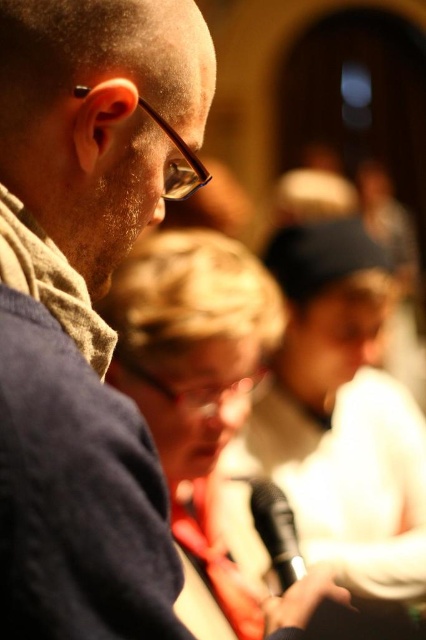
You are a photographer adjusting your camera settings to focus on the matte black glasses at upper left and the black matte microphone at lower center. Since the background is blurred, which object should you prioritize focusing on to ensure both are sharp?

The matte black glasses at upper left is closer to the viewer than the black matte microphone at lower center. To ensure both are sharp, prioritize focusing on the matte black glasses at upper left because it is closer, and the microphone will be within the depth of field if focused properly.

You are a photographer adjusting the camera focus. You need to ensure that both the matte black glasses at upper left and the black matte microphone at lower center are in focus. Given their heights, which object should you prioritize focusing on first to ensure proper depth of field?

The matte black glasses at upper left has a greater height compared to the black matte microphone at lower center. Since it is taller, you should prioritize focusing on the matte black glasses at upper left first to ensure proper depth of field.

You are a photographer who needs to adjust the lighting to ensure the matte black glasses at upper left are properly lit. Given their position at point 0.480, 0.200, where would you place the light source relative to the glasses?

The matte black glasses at upper left are positioned at coordinates 0.480 on the x and 0.200 on the y. To properly light them, the photographer should place the light source in a position that illuminates the glasses directly, such as slightly above and to the side of the glasses to avoid harsh shadows.